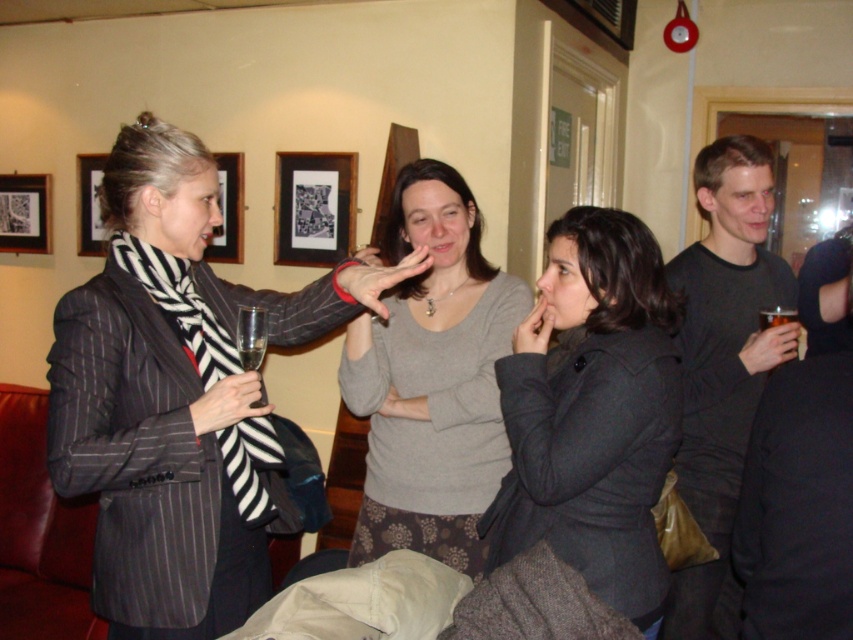
You are a photographer at the event and want to take a photo that includes both the striped fabric scarf at left and the gray sweater at center. Which object should you position closer to the camera to ensure both are visible clearly?

The striped fabric scarf at left is in front of the gray sweater at center, so positioning the striped fabric scarf at left closer to the camera will ensure both are visible clearly.

You are a photographer at the event and want to capture a photo of the gray sweater at center without the matte black picture frame at upper left appearing in the background. Is this possible?

Yes, since the gray sweater at center is in front of the matte black picture frame at upper left, you can position yourself so that the sweater blocks the frame from the camera view.

What is the position of the striped fabric scarf at left relative to the other objects in the scene?

The striped fabric scarf at left is located at point (x=178, y=397).